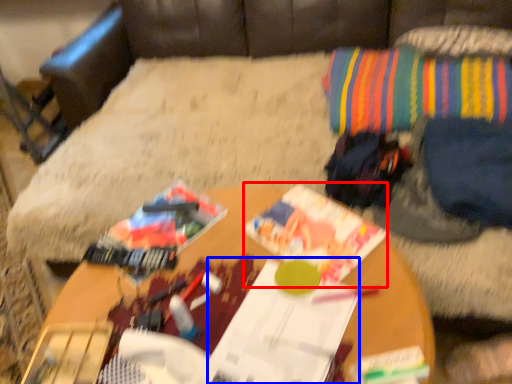
Question: Which point is further to the camera, magazine (highlighted by a red box) or magazine (highlighted by a blue box)?

Choices:
 (A) magazine
 (B) magazine

Answer: (A)